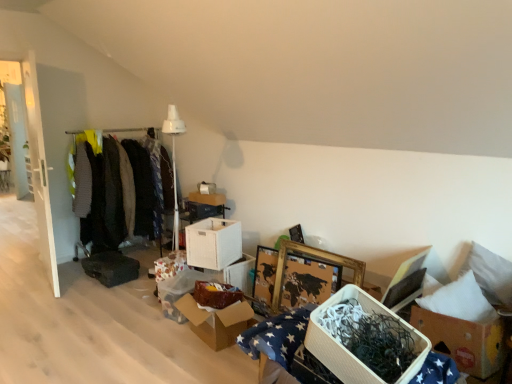
Question: Can knit sweater at left, which is the second clothing in right-to-left order, be found inside dark green fabric at left, acting as the 3th clothing starting from the right?

Choices:
 (A) yes
 (B) no

Answer: (B)

Question: From the image's perspective, would you say dark green fabric at left, acting as the 3th clothing starting from the right, is positioned over knit sweater at left, marked as the 2th clothing in a left-to-right arrangement?

Choices:
 (A) no
 (B) yes

Answer: (B)

Question: Could you tell me if dark green fabric at left, arranged as the first clothing when viewed from the left, is turned towards knit sweater at left, which is the second clothing in right-to-left order?

Choices:
 (A) yes
 (B) no

Answer: (A)

Question: Are dark green fabric at left, acting as the 3th clothing starting from the right, and knit sweater at left, which is the second clothing in right-to-left order, far apart?

Choices:
 (A) no
 (B) yes

Answer: (A)

Question: Is knit sweater at left, which is the second clothing in right-to-left order, at the back of dark green fabric at left, acting as the 3th clothing starting from the right?

Choices:
 (A) yes
 (B) no

Answer: (A)

Question: Is knit sweater at left, which is the second clothing in right-to-left order, to the left or to the right of dark green fabric at left, arranged as the first clothing when viewed from the left, in the image?

Choices:
 (A) left
 (B) right

Answer: (B)

Question: From their relative heights in the image, would you say knit sweater at left, marked as the 2th clothing in a left-to-right arrangement, is taller or shorter than dark green fabric at left, acting as the 3th clothing starting from the right?

Choices:
 (A) tall
 (B) short

Answer: (A)

Question: Would you say knit sweater at left, which is the second clothing in right-to-left order, is inside or outside dark green fabric at left, arranged as the first clothing when viewed from the left?

Choices:
 (A) inside
 (B) outside

Answer: (B)

Question: Is knit sweater at left, which is the second clothing in right-to-left order, wider or thinner than dark green fabric at left, acting as the 3th clothing starting from the right?

Choices:
 (A) thin
 (B) wide

Answer: (A)

Question: Is white cardboard box at center, arranged as the fourth storage box when viewed from the back, taller or shorter than white cardboard box at lower right, the 2th cardboard box viewed from the back?

Choices:
 (A) tall
 (B) short

Answer: (B)

Question: Based on their sizes in the image, would you say white cardboard box at center, the 3th storage box viewed from the front, is bigger or smaller than white cardboard box at lower right, arranged as the 2th cardboard box when viewed from the left?

Choices:
 (A) small
 (B) big

Answer: (A)

Question: From the image's perspective, is white cardboard box at center, the 3th storage box viewed from the front, positioned above or below white cardboard box at lower right, which is the 1th cardboard box from right to left?

Choices:
 (A) above
 (B) below

Answer: (A)

Question: Considering the positions of point (207, 241) and point (497, 342), is point (207, 241) closer or farther from the camera than point (497, 342)?

Choices:
 (A) closer
 (B) farther

Answer: (B)

Question: Does point (169, 314) appear closer or farther from the camera than point (198, 195)?

Choices:
 (A) closer
 (B) farther

Answer: (A)

Question: Considering their positions, is matte cardboard box at center, the fifth storage box when ordered from back to front, located in front of or behind white cardboard box at center, which ranks as the second storage box in back-to-front order?

Choices:
 (A) front
 (B) behind

Answer: (A)